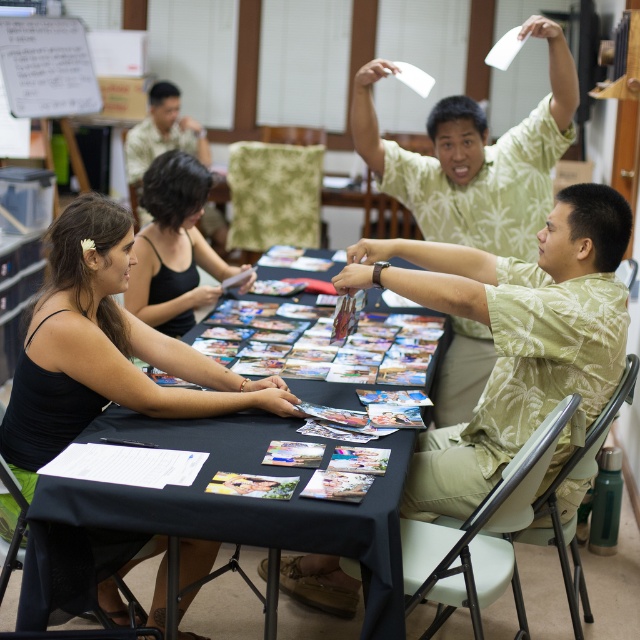
Question: Does black paper at center appear over black tank top at upper left?

Choices:
 (A) no
 (B) yes

Answer: (A)

Question: Does green floral shirt at right have a smaller size compared to green leaf-patterned shirt at upper right?

Choices:
 (A) yes
 (B) no

Answer: (B)

Question: Does green floral shirt at right have a lesser width compared to black paper at center?

Choices:
 (A) yes
 (B) no

Answer: (A)

Question: Which point appears farthest from the camera in this image?

Choices:
 (A) (147, 284)
 (B) (465, 193)
 (C) (346, 390)

Answer: (B)

Question: Which point appears farthest from the camera in this image?

Choices:
 (A) (547, 170)
 (B) (189, 234)
 (C) (432, 465)
 (D) (269, 435)

Answer: (B)

Question: Which of the following is the closest to the observer?

Choices:
 (A) black tank top at upper left
 (B) green floral shirt at right

Answer: (B)